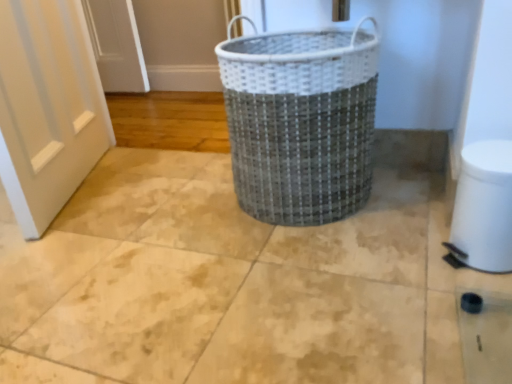
Find the location of a particular element. The image size is (512, 384). vacant point to the left of white plastic toilet bowl at lower right is located at coordinates (406, 266).